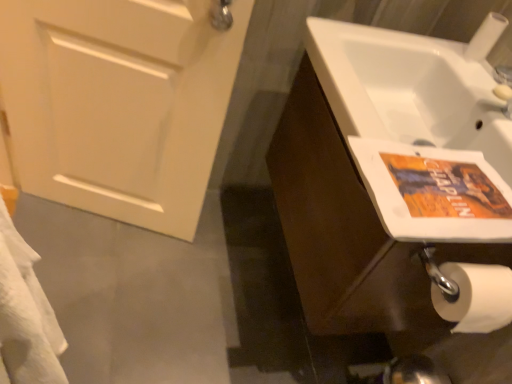
What do you see at coordinates (434, 192) in the screenshot? The width and height of the screenshot is (512, 384). I see `orange paper flyer at right` at bounding box center [434, 192].

Identify the location of orange paper flyer at right. Image resolution: width=512 pixels, height=384 pixels. (434, 192).

Which of these two, orange paper flyer at right or white matte toilet paper at lower right, stands shorter?

With less height is orange paper flyer at right.

Is orange paper flyer at right to the left of white matte toilet paper at lower right from the viewer's perspective?

Correct, you'll find orange paper flyer at right to the left of white matte toilet paper at lower right.

How distant is orange paper flyer at right from white matte toilet paper at lower right?

orange paper flyer at right and white matte toilet paper at lower right are 53.64 centimeters apart.

Could white matte toilet paper at lower right be considered to be inside orange paper flyer at right?

Actually, white matte toilet paper at lower right is outside orange paper flyer at right.

Can you confirm if white matte door at left is positioned to the right of brown wood cabinet at right?

In fact, white matte door at left is to the left of brown wood cabinet at right.

In order to click on door above the brown wood cabinet at right (from the image's perspective) in this screenshot , I will do coord(118,103).

Is white matte door at left positioned beyond the bounds of brown wood cabinet at right?

white matte door at left lies outside brown wood cabinet at right's area.

From the image's perspective, which one is positioned higher, white matte door at left or brown wood cabinet at right?

white matte door at left is shown above in the image.

Locate an element on the screen. The height and width of the screenshot is (384, 512). bathroom cabinet beneath the orange paper flyer at right (from a real-world perspective) is located at coordinates (338, 227).

Does orange paper flyer at right touch brown wood cabinet at right?

No, orange paper flyer at right is not making contact with brown wood cabinet at right.

Looking at this image, from the image's perspective, which is below, orange paper flyer at right or brown wood cabinet at right?

orange paper flyer at right, from the image's perspective.

Could you tell me if orange paper flyer at right is turned towards brown wood cabinet at right?

No.

Between white matte toilet paper at lower right and orange paper flyer at right, which one has larger width?

Wider between the two is orange paper flyer at right.

Between white matte toilet paper at lower right and orange paper flyer at right, which one appears on the left side from the viewer's perspective?

orange paper flyer at right is more to the left.

Between white matte toilet paper at lower right and orange paper flyer at right, which one has less height?

Standing shorter between the two is orange paper flyer at right.

From the image's perspective, is white matte toilet paper at lower right below white matte door at left?

No, from the image's perspective, white matte toilet paper at lower right is not below white matte door at left.

The width and height of the screenshot is (512, 384). In order to click on door that appears below the white matte toilet paper at lower right (from a real-world perspective) in this screenshot , I will do `click(118, 103)`.

Does white matte toilet paper at lower right have a smaller size compared to white matte door at left?

Correct, white matte toilet paper at lower right occupies less space than white matte door at left.

Is white matte toilet paper at lower right thinner than white matte door at left?

Correct, the width of white matte toilet paper at lower right is less than that of white matte door at left.

Would you say brown wood cabinet at right is a long distance from white matte toilet paper at lower right?

They are positioned close to each other.

Does point (356, 177) come in front of point (494, 34)?

Yes, point (356, 177) is closer to viewer.

Does brown wood cabinet at right have a larger size compared to white matte toilet paper at lower right?

Correct, brown wood cabinet at right is larger in size than white matte toilet paper at lower right.

From the picture: Which object is more forward, brown wood cabinet at right or white matte toilet paper at lower right?

Positioned in front is brown wood cabinet at right.

Locate an element on the screen. bathroom cabinet below the white matte door at left (from the image's perspective) is located at coordinates (338, 227).

Could you tell me if brown wood cabinet at right is facing white matte door at left?

Yes, brown wood cabinet at right is turned towards white matte door at left.

Does point (340, 182) appear closer or farther from the camera than point (8, 91)?

Point (340, 182) appears to be closer to the viewer than point (8, 91).

Identify the location of flyer lying on the left of white matte toilet paper at lower right. The width and height of the screenshot is (512, 384). (434, 192).

Where is `bathroom cabinet on the right of white matte door at left`? bathroom cabinet on the right of white matte door at left is located at coordinates (338, 227).

Estimate the real-world distances between objects in this image. Which object is closer to brown wood cabinet at right, orange paper flyer at right or white matte toilet paper at lower right?

Based on the image, orange paper flyer at right appears to be nearer to brown wood cabinet at right.

Based on their spatial positions, is white matte toilet paper at lower right or orange paper flyer at right closer to white matte door at left?

orange paper flyer at right is positioned closer to the anchor white matte door at left.

Which object lies nearer to the anchor point brown wood cabinet at right, orange paper flyer at right or white matte door at left?

orange paper flyer at right.

Which object lies further to the anchor point brown wood cabinet at right, white matte door at left or orange paper flyer at right?

The object further to brown wood cabinet at right is white matte door at left.

Based on their spatial positions, is white matte toilet paper at lower right or brown wood cabinet at right further from orange paper flyer at right?

white matte toilet paper at lower right is further to orange paper flyer at right.

When comparing their distances from white matte toilet paper at lower right, does white matte door at left or orange paper flyer at right seem further?

Based on the image, white matte door at left appears to be further to white matte toilet paper at lower right.

Estimate the real-world distances between objects in this image. Which object is closer to white matte toilet paper at lower right, white matte door at left or brown wood cabinet at right?

brown wood cabinet at right is closer to white matte toilet paper at lower right.

Which object lies nearer to the anchor point orange paper flyer at right, brown wood cabinet at right or white matte toilet paper at lower right?

brown wood cabinet at right lies closer to orange paper flyer at right than the other object.

I want to click on bathroom cabinet located between white matte door at left and white matte toilet paper at lower right in the left-right direction, so click(338, 227).

Identify the location of bathroom cabinet between white matte toilet paper at lower right and orange paper flyer at right vertically. The image size is (512, 384). (338, 227).

The height and width of the screenshot is (384, 512). Identify the location of flyer situated between white matte door at left and brown wood cabinet at right from left to right. (434, 192).

The width and height of the screenshot is (512, 384). I want to click on flyer between white matte door at left and white matte toilet paper at lower right, so click(x=434, y=192).